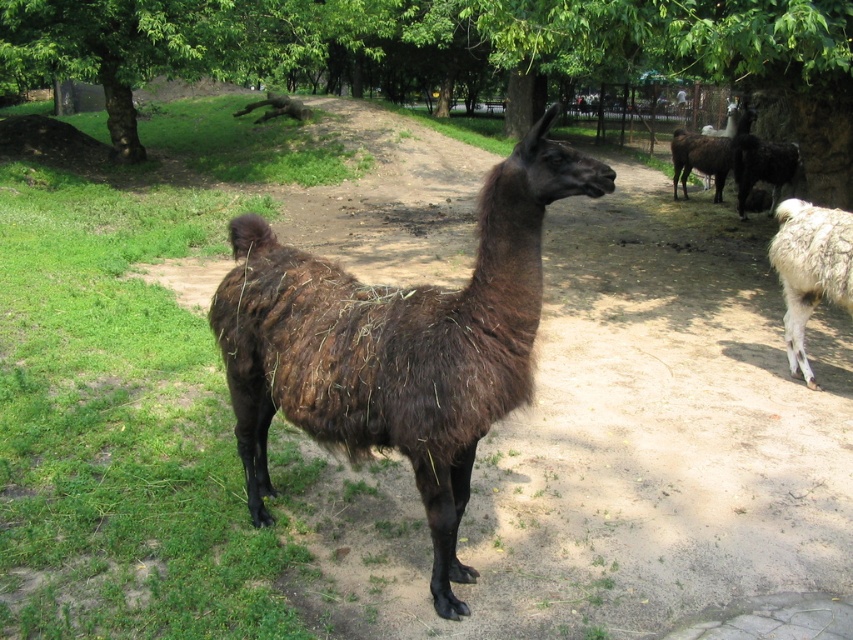
You are a zookeeper observing the alpacas. You see the white woolly alpaca at right and the dark brown woolly alpaca at upper right. Which alpaca is positioned to the left of the other?

The white woolly alpaca at right is to the left of the dark brown woolly alpaca at upper right.

You are a zookeeper trying to feed the alpacas. You have two buckets of food. You want to give the brown fuzzy alpaca at center the first bucket and the white woolly alpaca at right the second bucket. Since you can only carry one bucket at a time, which alpaca should you approach first to minimize walking distance?

You should approach the brown fuzzy alpaca at center first because it is closer to you than the white woolly alpaca at right, so you can give the first bucket without walking further away first.